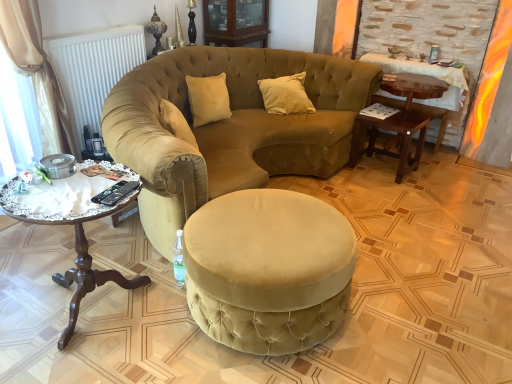
Where is `free space to the back side of black plastic remote control at lower left`? free space to the back side of black plastic remote control at lower left is located at coordinates (111, 176).